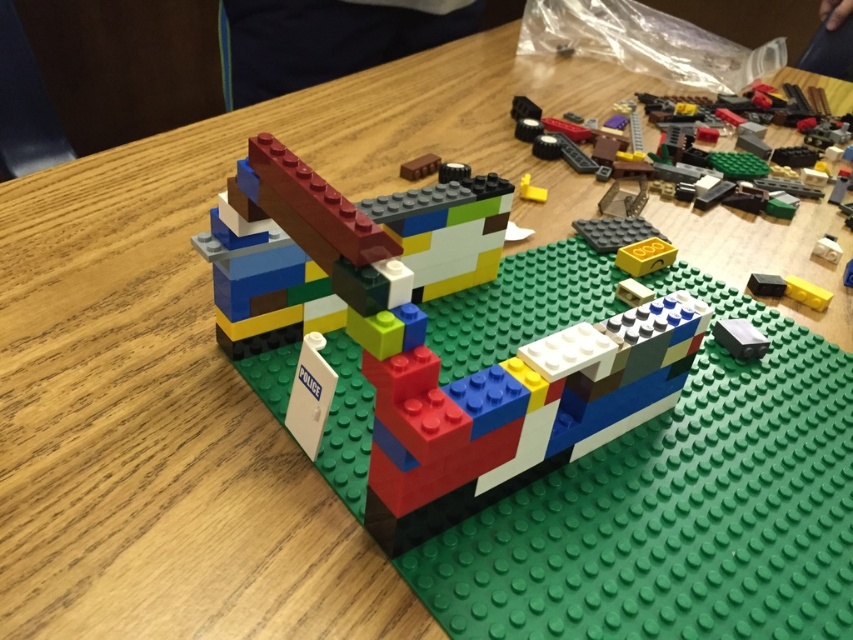
Question: Which point appears closest to the camera in this image?

Choices:
 (A) (444, 204)
 (B) (790, 164)
 (C) (532, 195)
 (D) (672, 305)

Answer: (D)

Question: Does multicolored plastic building blocks at center have a lesser width compared to translucent yellow plastic at upper right?

Choices:
 (A) yes
 (B) no

Answer: (A)

Question: Which point is farther to the camera?

Choices:
 (A) yellow matte block at center
 (B) translucent yellow plastic at upper right

Answer: (A)

Question: Which of the following is the closest to the observer?

Choices:
 (A) (544, 198)
 (B) (676, 129)
 (C) (376, 273)
 (D) (393, 508)

Answer: (C)

Question: Does multicolored plastic blocks at center come behind translucent yellow plastic at upper right?

Choices:
 (A) yes
 (B) no

Answer: (B)

Question: Is multicolored plastic building blocks at center positioned in front of yellow matte block at center?

Choices:
 (A) no
 (B) yes

Answer: (B)